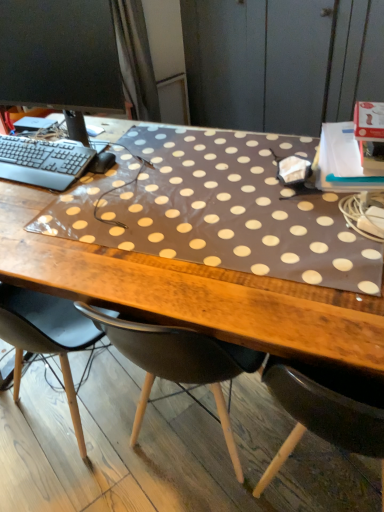
Question: Should I look upward or downward to see black matte mouse at center?

Choices:
 (A) up
 (B) down

Answer: (A)

Question: Would you say black plastic keyboard at left is part of brown fabric dresser at upper right's contents?

Choices:
 (A) yes
 (B) no

Answer: (B)

Question: From the image's perspective, is brown fabric dresser at upper right over black plastic keyboard at left?

Choices:
 (A) no
 (B) yes

Answer: (B)

Question: Can you confirm if brown fabric dresser at upper right is wider than black plastic keyboard at left?

Choices:
 (A) no
 (B) yes

Answer: (B)

Question: Is brown fabric dresser at upper right outside of black plastic keyboard at left?

Choices:
 (A) no
 (B) yes

Answer: (B)

Question: Is brown fabric dresser at upper right thinner than black plastic keyboard at left?

Choices:
 (A) no
 (B) yes

Answer: (A)

Question: Considering the relative sizes of brown fabric dresser at upper right and black plastic keyboard at left in the image provided, is brown fabric dresser at upper right bigger than black plastic keyboard at left?

Choices:
 (A) yes
 (B) no

Answer: (A)

Question: Is black plastic keyboard at left shorter than brown polka dot mat at center?

Choices:
 (A) yes
 (B) no

Answer: (A)

Question: From the image's perspective, is black plastic keyboard at left on top of brown polka dot mat at center?

Choices:
 (A) no
 (B) yes

Answer: (B)

Question: Is black plastic keyboard at left surrounding brown polka dot mat at center?

Choices:
 (A) yes
 (B) no

Answer: (B)

Question: Is black plastic keyboard at left completely or partially outside of brown polka dot mat at center?

Choices:
 (A) no
 (B) yes

Answer: (A)

Question: Does black plastic keyboard at left appear on the right side of brown polka dot mat at center?

Choices:
 (A) yes
 (B) no

Answer: (B)

Question: Is black plastic keyboard at left positioned behind brown polka dot mat at center?

Choices:
 (A) yes
 (B) no

Answer: (A)

Question: Can you confirm if black plastic keyboard at left is positioned to the left of brown fabric dresser at upper right?

Choices:
 (A) yes
 (B) no

Answer: (A)